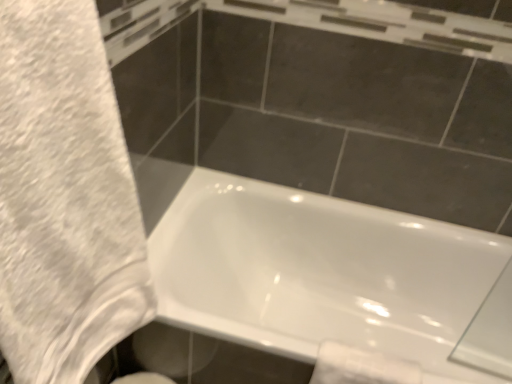
Question: Is white glossy bathtub at lower center to the left of white fluffy towel at left from the viewer's perspective?

Choices:
 (A) yes
 (B) no

Answer: (B)

Question: Is white glossy bathtub at lower center smaller than white fluffy towel at left?

Choices:
 (A) no
 (B) yes

Answer: (A)

Question: From a real-world perspective, is white glossy bathtub at lower center below white fluffy towel at left?

Choices:
 (A) no
 (B) yes

Answer: (B)

Question: Is white glossy bathtub at lower center further to the viewer compared to white fluffy towel at left?

Choices:
 (A) yes
 (B) no

Answer: (A)

Question: Is white glossy bathtub at lower center taller than white fluffy towel at left?

Choices:
 (A) yes
 (B) no

Answer: (B)

Question: Could you tell me if white glossy bathtub at lower center is facing white fluffy towel at left?

Choices:
 (A) yes
 (B) no

Answer: (B)

Question: Is white glossy toilet paper at lower right shorter than white glossy bathtub at lower center?

Choices:
 (A) yes
 (B) no

Answer: (A)

Question: From a real-world perspective, is white glossy toilet paper at lower right beneath white glossy bathtub at lower center?

Choices:
 (A) no
 (B) yes

Answer: (A)

Question: Is the position of white glossy toilet paper at lower right less distant than that of white glossy bathtub at lower center?

Choices:
 (A) yes
 (B) no

Answer: (B)

Question: From the image's perspective, would you say white glossy toilet paper at lower right is positioned over white glossy bathtub at lower center?

Choices:
 (A) yes
 (B) no

Answer: (B)

Question: Is white glossy toilet paper at lower right further to camera compared to white glossy bathtub at lower center?

Choices:
 (A) no
 (B) yes

Answer: (B)

Question: Can you confirm if white glossy toilet paper at lower right is bigger than white glossy bathtub at lower center?

Choices:
 (A) yes
 (B) no

Answer: (B)

Question: Is white fluffy towel at left wider than white glossy toilet paper at lower right?

Choices:
 (A) yes
 (B) no

Answer: (A)